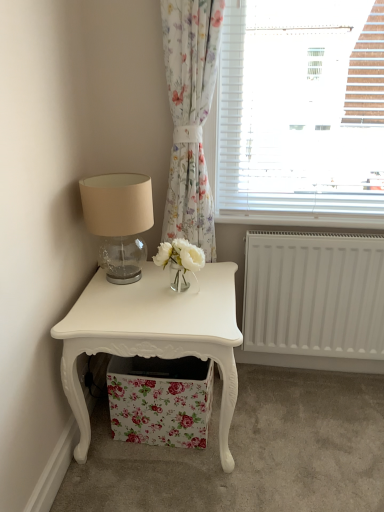
Question: Considering the relative positions of floral fabric storage box at lower center and floral fabric curtain at upper center in the image provided, is floral fabric storage box at lower center to the left of floral fabric curtain at upper center from the viewer's perspective?

Choices:
 (A) no
 (B) yes

Answer: (B)

Question: Does floral fabric storage box at lower center have a greater height compared to floral fabric curtain at upper center?

Choices:
 (A) no
 (B) yes

Answer: (A)

Question: From a real-world perspective, does floral fabric storage box at lower center stand above floral fabric curtain at upper center?

Choices:
 (A) yes
 (B) no

Answer: (B)

Question: Is floral fabric storage box at lower center further to the viewer compared to floral fabric curtain at upper center?

Choices:
 (A) no
 (B) yes

Answer: (B)

Question: Considering the relative sizes of floral fabric storage box at lower center and floral fabric curtain at upper center in the image provided, is floral fabric storage box at lower center smaller than floral fabric curtain at upper center?

Choices:
 (A) yes
 (B) no

Answer: (A)

Question: Is point (183, 402) positioned closer to the camera than point (142, 197)?

Choices:
 (A) closer
 (B) farther

Answer: (B)

Question: Considering the positions of floral fabric storage box at lower center and matte glass table lamp at upper left in the image, is floral fabric storage box at lower center wider or thinner than matte glass table lamp at upper left?

Choices:
 (A) thin
 (B) wide

Answer: (B)

Question: Is floral fabric storage box at lower center spatially inside matte glass table lamp at upper left, or outside of it?

Choices:
 (A) outside
 (B) inside

Answer: (A)

Question: From the image's perspective, relative to matte glass table lamp at upper left, is floral fabric storage box at lower center above or below?

Choices:
 (A) above
 (B) below

Answer: (B)

Question: From a real-world perspective, is matte glass table lamp at upper left physically located above or below white glossy nightstand at lower left?

Choices:
 (A) above
 (B) below

Answer: (A)

Question: From the image's perspective, is matte glass table lamp at upper left above or below white glossy nightstand at lower left?

Choices:
 (A) above
 (B) below

Answer: (A)

Question: In terms of height, does matte glass table lamp at upper left look taller or shorter compared to white glossy nightstand at lower left?

Choices:
 (A) short
 (B) tall

Answer: (A)

Question: Considering the relative positions of matte glass table lamp at upper left and white glossy nightstand at lower left in the image provided, is matte glass table lamp at upper left to the left or to the right of white glossy nightstand at lower left?

Choices:
 (A) left
 (B) right

Answer: (A)

Question: From the image's perspective, relative to white plastic radiator at lower center, is white glossy nightstand at lower left above or below?

Choices:
 (A) above
 (B) below

Answer: (B)

Question: Relative to white plastic radiator at lower center, is white glossy nightstand at lower left in front or behind?

Choices:
 (A) front
 (B) behind

Answer: (A)